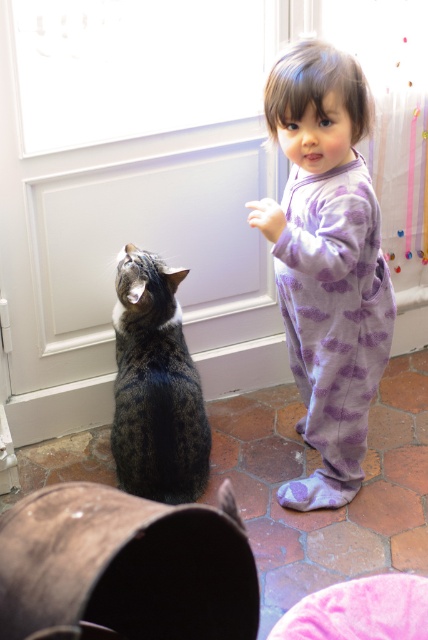
You are a delivery person trying to reach the front door of the house. You see the white glossy screen door at center and the purple fleece onesie at center in the scene. Which object should you approach first to reach the front door?

The white glossy screen door at center is to the left of the purple fleece onesie at center, so you should approach the white glossy screen door at center first to reach the front door.

You are a delivery person trying to deliver a package to the purple fleece onesie at center. The tabby fur cat at lower left is blocking the path. Can you walk around the cat to reach the onesie?

The purple fleece onesie at center is positioned over tabby fur cat at lower left, which means the cat is below the onesie. Since the cat is blocking the path, you can walk around it to reach the onesie.